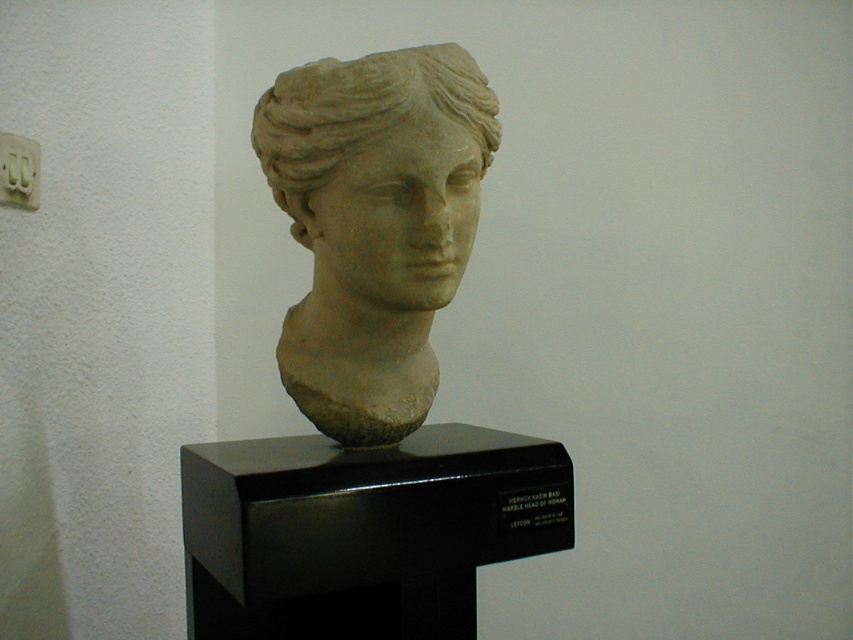
Between matte stone bust at center and white marble head at center, which one appears on the left side from the viewer's perspective?

A: matte stone bust at center is more to the left.

Between matte stone bust at center and white marble head at center, which one has more height?

matte stone bust at center

The image size is (853, 640). In order to click on matte stone bust at center in this screenshot , I will do `click(374, 225)`.